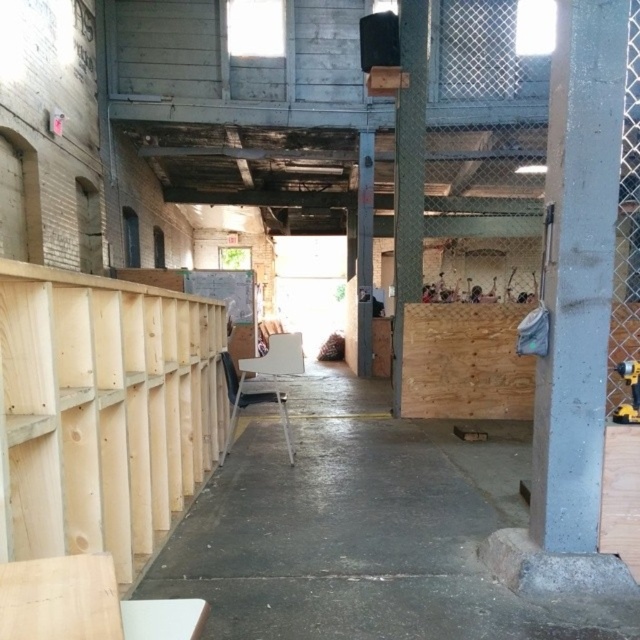
Where is `gray concrete pillar at right`? The image size is (640, 640). gray concrete pillar at right is located at coordinates (577, 269).

Between gray concrete pillar at right and wooden at right, which one is positioned lower?

gray concrete pillar at right is lower down.

Is point (560, 403) closer to viewer compared to point (406, 236)?

That is True.

This screenshot has width=640, height=640. What are the coordinates of `gray concrete pillar at right` in the screenshot? It's located at (577, 269).

Measure the distance between gray concrete pillar at center and camera.

They are 32.61 feet apart.

Locate an element on the screen. This screenshot has width=640, height=640. gray concrete pillar at center is located at coordinates click(364, 252).

Can you confirm if gray concrete pillar at right is shorter than metallic yellow drill at right?

No, gray concrete pillar at right is not shorter than metallic yellow drill at right.

Does gray concrete pillar at right have a greater height compared to metallic yellow drill at right?

Yes, gray concrete pillar at right is taller than metallic yellow drill at right.

Find the location of a particular element. gray concrete pillar at right is located at coordinates (577, 269).

Where is `gray concrete pillar at right`? Image resolution: width=640 pixels, height=640 pixels. gray concrete pillar at right is located at coordinates (577, 269).